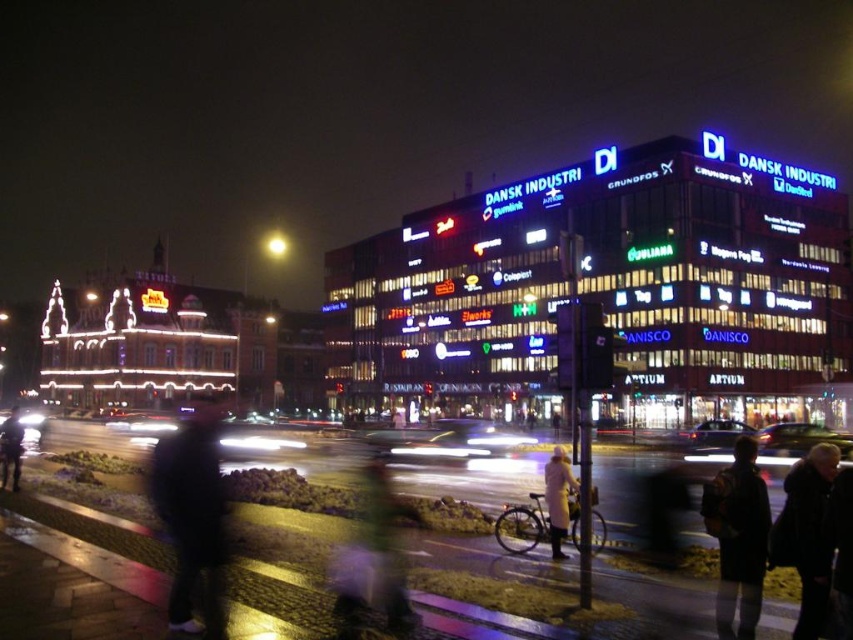
Is dark fabric jacket at lower left closer to the viewer compared to black matte jacket at lower right?

No, it is behind black matte jacket at lower right.

Between dark fabric jacket at lower left and black matte jacket at lower right, which one has less height?

black matte jacket at lower right is shorter.

Find the location of a particular element. dark fabric jacket at lower left is located at coordinates coord(192,516).

Between dark fabric jacket at lower right and green fabric jacket at center, which one is positioned higher?

Positioned higher is dark fabric jacket at lower right.

Can you confirm if dark fabric jacket at lower right is thinner than green fabric jacket at center?

No.

What do you see at coordinates (738, 538) in the screenshot? Image resolution: width=853 pixels, height=640 pixels. I see `dark fabric jacket at lower right` at bounding box center [738, 538].

Locate an element on the screen. Image resolution: width=853 pixels, height=640 pixels. dark fabric jacket at lower right is located at coordinates (738, 538).

Based on the photo, is the position of dark fabric jacket at lower left less distant than that of dark blue jacket at lower left?

Yes, dark fabric jacket at lower left is closer to the viewer.

Can you confirm if dark fabric jacket at lower left is positioned below dark blue jacket at lower left?

Actually, dark fabric jacket at lower left is above dark blue jacket at lower left.

Where is `dark fabric jacket at lower left`? This screenshot has height=640, width=853. dark fabric jacket at lower left is located at coordinates (192, 516).